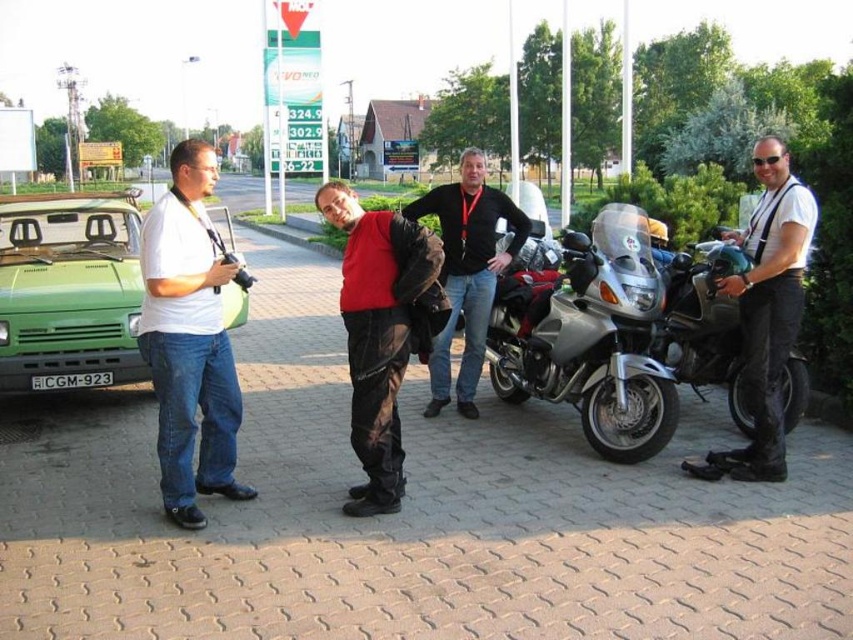
Is silver metallic motorcycle at center positioned before white matte shirt at left?

No, it is behind white matte shirt at left.

Which is behind, point (582, 317) or point (149, 294)?

Point (582, 317)

Identify the location of silver metallic motorcycle at center. The width and height of the screenshot is (853, 640). (590, 337).

This screenshot has width=853, height=640. Identify the location of silver metallic motorcycle at center. (590, 337).

Measure the distance between dark gray leather jacket at center and black plastic license plate at center.

→ They are 3.11 meters apart.

Can you confirm if dark gray leather jacket at center is shorter than black plastic license plate at center?

In fact, dark gray leather jacket at center may be taller than black plastic license plate at center.

Identify the location of dark gray leather jacket at center. The width and height of the screenshot is (853, 640). (467, 272).

Is red matte jacket at center to the left of black plastic license plate at center from the viewer's perspective?

Incorrect, red matte jacket at center is not on the left side of black plastic license plate at center.

Is point (326, 204) positioned in front of point (53, 385)?

Yes.

Where is `red matte jacket at center`? The image size is (853, 640). red matte jacket at center is located at coordinates (381, 332).